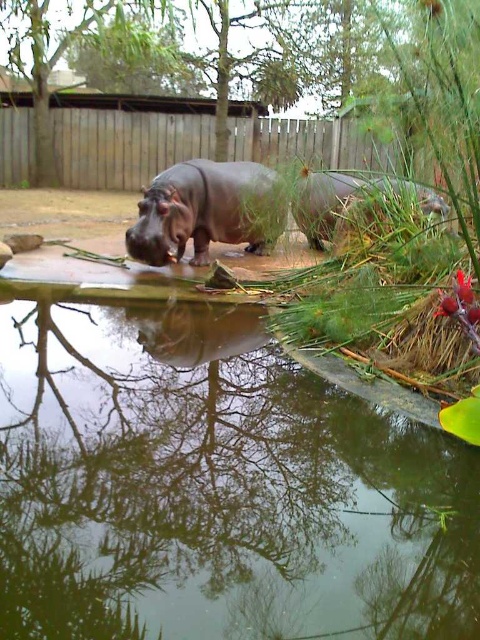
Question: Estimate the real-world distances between objects in this image. Which object is closer to the brown matte rhinoceros at right?

Choices:
 (A) brown matte hippo at center
 (B) green reflective water at center

Answer: (A)

Question: Does brown matte hippo at center appear on the right side of brown matte rhinoceros at right?

Choices:
 (A) yes
 (B) no

Answer: (B)

Question: Can you confirm if brown matte hippo at center is positioned below brown matte rhinoceros at right?

Choices:
 (A) no
 (B) yes

Answer: (A)

Question: Which of the following is the closest to the observer?

Choices:
 (A) (173, 209)
 (B) (196, 500)

Answer: (B)

Question: Which object appears closest to the camera in this image?

Choices:
 (A) brown matte hippo at center
 (B) green reflective water at center
 (C) brown matte rhinoceros at right

Answer: (B)

Question: Can you confirm if brown matte hippo at center is smaller than brown matte rhinoceros at right?

Choices:
 (A) no
 (B) yes

Answer: (A)